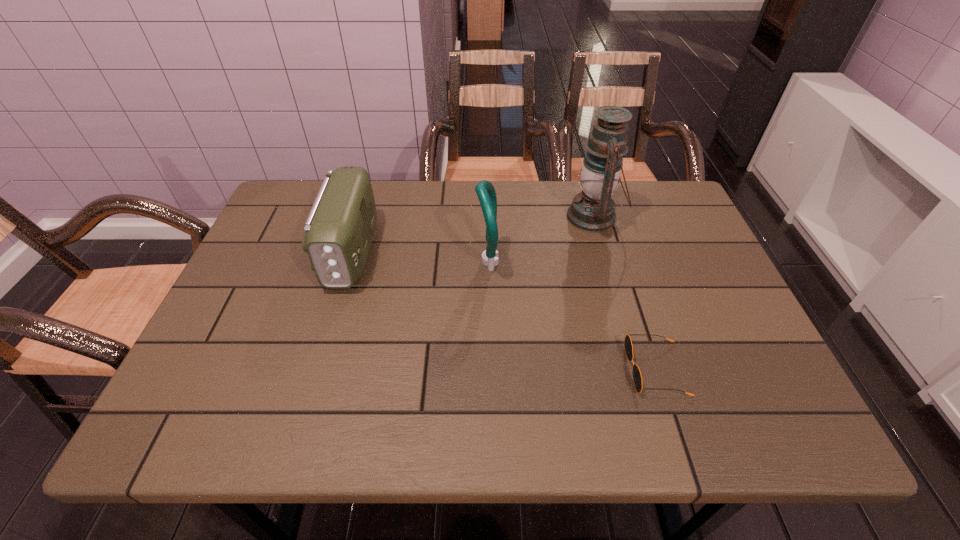
The height and width of the screenshot is (540, 960). I want to click on the tallest object, so click(593, 210).

You are a GUI agent. You are given a task and a screenshot of the screen. Output one action in this format:
    pyautogui.click(x=<x>, y=<y>)
    Task: Click on the third object from right to left
    The image size is (960, 540).
    Given the screenshot: What is the action you would take?
    pyautogui.click(x=486, y=193)

Locate an element on the screen. This screenshot has height=540, width=960. bottle opener is located at coordinates (486, 193).

Identify the location of radio_receiver. The height and width of the screenshot is (540, 960). (339, 228).

Find the location of a particular element. The image size is (960, 540). the leftmost object is located at coordinates (339, 228).

The height and width of the screenshot is (540, 960). What are the coordinates of `the shortest object` in the screenshot? It's located at (637, 378).

You are a GUI agent. You are given a task and a screenshot of the screen. Output one action in this format:
    pyautogui.click(x=<x>, y=<y>)
    Task: Click on the nearest object
    
    Given the screenshot: What is the action you would take?
    pyautogui.click(x=637, y=378)

Where is `vacant area located 0.240m on the left of the tallest object`? vacant area located 0.240m on the left of the tallest object is located at coordinates (483, 217).

This screenshot has height=540, width=960. What are the coordinates of `vacant space located 0.190m at the jaws of the second object from left to right` in the screenshot? It's located at (402, 261).

Find the location of a particular element. The image size is (960, 540). vacant space located 0.170m at the jaws of the second object from left to right is located at coordinates (410, 261).